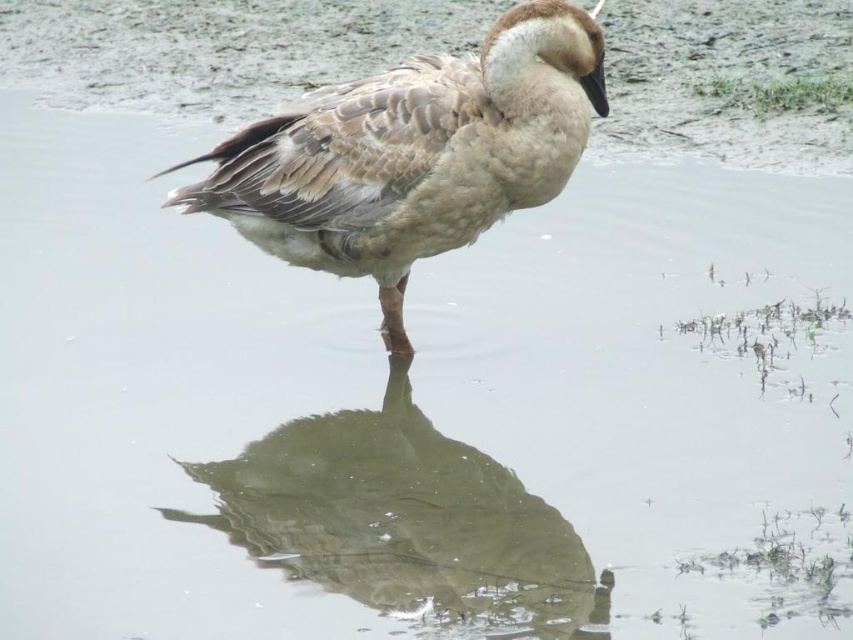
Does brown speckled duck at center have a greater height compared to greenish-gray reflective surface at center?

Yes.

Which is behind, point (415, 67) or point (440, 500)?

Positioned behind is point (415, 67).

Is point (502, 60) less distant than point (543, 573)?

No, it is behind (543, 573).

Where is `brown speckled duck at center`? This screenshot has width=853, height=640. brown speckled duck at center is located at coordinates (413, 154).